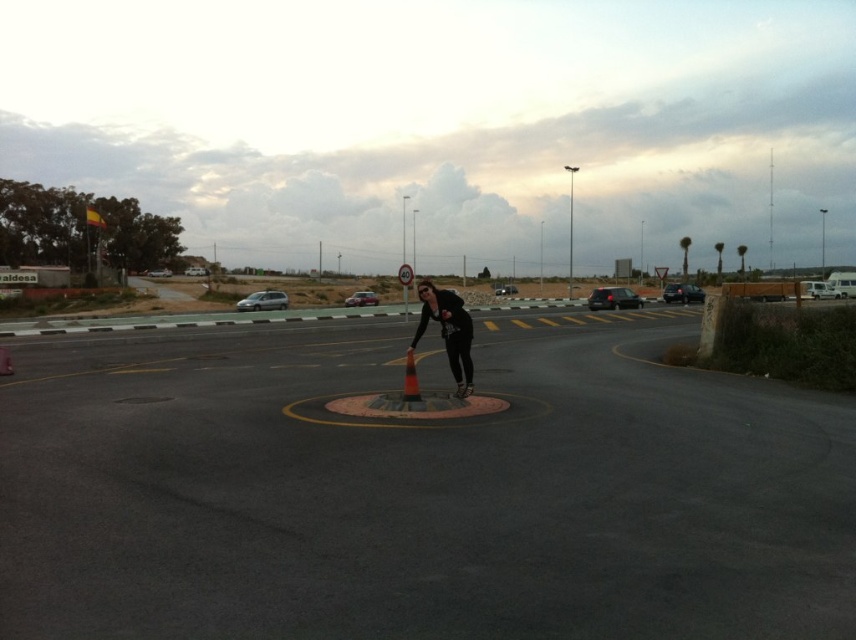
Is shiny black sedan at right positioned behind satin silver minivan at left?

No.

Does point (633, 292) come in front of point (236, 301)?

Yes, it is.

What are the coordinates of `shiny black sedan at right` in the screenshot? It's located at (613, 298).

What are the coordinates of `shiny black sedan at right` in the screenshot? It's located at (613, 298).

Is black matte skater at center to the right of black glossy car at right from the viewer's perspective?

Incorrect, black matte skater at center is not on the right side of black glossy car at right.

What do you see at coordinates (449, 330) in the screenshot? This screenshot has width=856, height=640. I see `black matte skater at center` at bounding box center [449, 330].

Find the location of a particular element. This screenshot has height=640, width=856. black matte skater at center is located at coordinates (449, 330).

Does black glossy car at right have a lesser height compared to matte black car at center?

Yes, black glossy car at right is shorter than matte black car at center.

Is point (676, 296) farther from viewer compared to point (508, 292)?

That is False.

In order to click on black glossy car at right in this screenshot , I will do `click(682, 292)`.